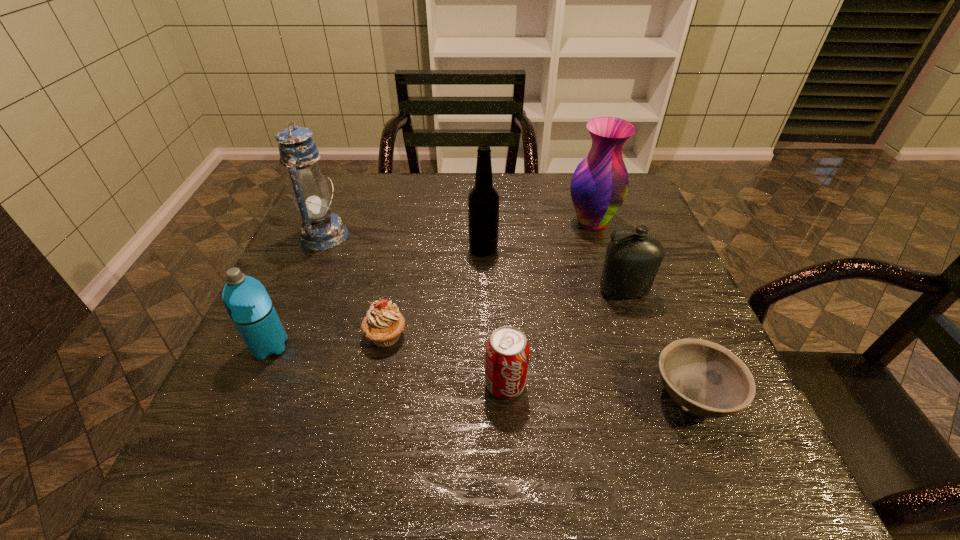
Identify the location of vacant space situated 0.390m on the left of the beer bottle. (317, 249).

Find the location of a particular element. The width and height of the screenshot is (960, 540). vacant space located on the left of the vase is located at coordinates (482, 222).

Find the location of `vacant region located 0.360m on the back of the thermos bottle`. vacant region located 0.360m on the back of the thermos bottle is located at coordinates (321, 230).

You are a GUI agent. You are given a task and a screenshot of the screen. Output one action in this format:
    pyautogui.click(x=<x>, y=<y>)
    Task: Click on the free region located 0.270m on the back of the bottle
    The width and height of the screenshot is (960, 540).
    Given the screenshot: What is the action you would take?
    pyautogui.click(x=597, y=214)

Where is `vacant region located on the right of the sixth tallest object`? The width and height of the screenshot is (960, 540). vacant region located on the right of the sixth tallest object is located at coordinates (568, 384).

Image resolution: width=960 pixels, height=540 pixels. Find the location of `free space located on the back of the cupcake`. free space located on the back of the cupcake is located at coordinates (405, 240).

You are a GUI agent. You are given a task and a screenshot of the screen. Output one action in this format:
    pyautogui.click(x=<x>, y=<y>)
    Task: Click on the free space located 0.210m on the left of the shortest object
    This screenshot has height=540, width=960.
    Given the screenshot: What is the action you would take?
    pyautogui.click(x=538, y=396)

Locate an element on the screen. This screenshot has width=960, height=540. object at the far edge is located at coordinates (599, 185).

Identify the location of lantern that is at the left edge. (320, 230).

The image size is (960, 540). Find the location of `thermos bottle at the left edge`. thermos bottle at the left edge is located at coordinates click(x=246, y=300).